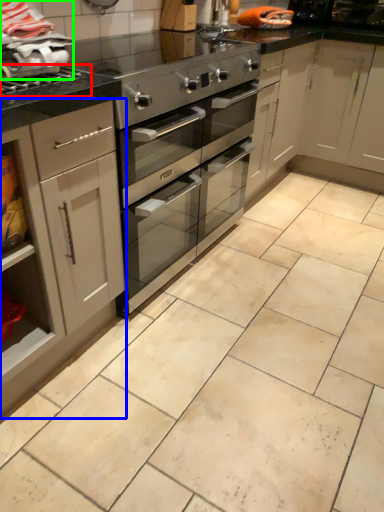
Question: Estimate the real-world distances between objects in this image. Which object is farther from gas stove (highlighted by a red box), cabinetry (highlighted by a blue box) or material (highlighted by a green box)?

Choices:
 (A) cabinetry
 (B) material

Answer: (A)